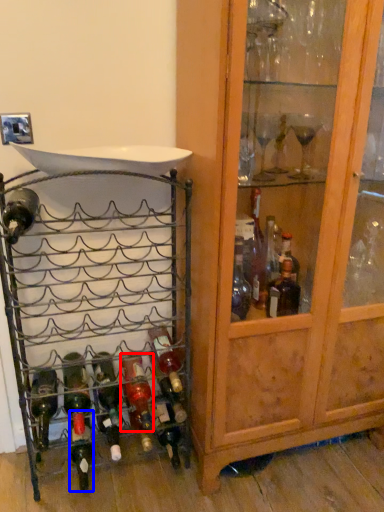
Question: Among these objects, which one is nearest to the camera, bottle (highlighted by a red box) or bottle (highlighted by a blue box)?

Choices:
 (A) bottle
 (B) bottle

Answer: (A)